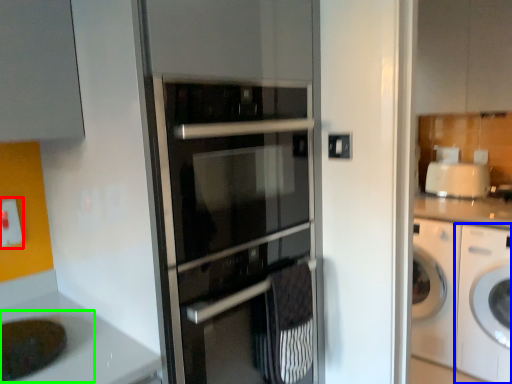
Question: Considering the real-world distances, which object is farthest from electric outlet (highlighted by a red box)? washing machine (highlighted by a blue box) or sink (highlighted by a green box)?

Choices:
 (A) washing machine
 (B) sink

Answer: (A)